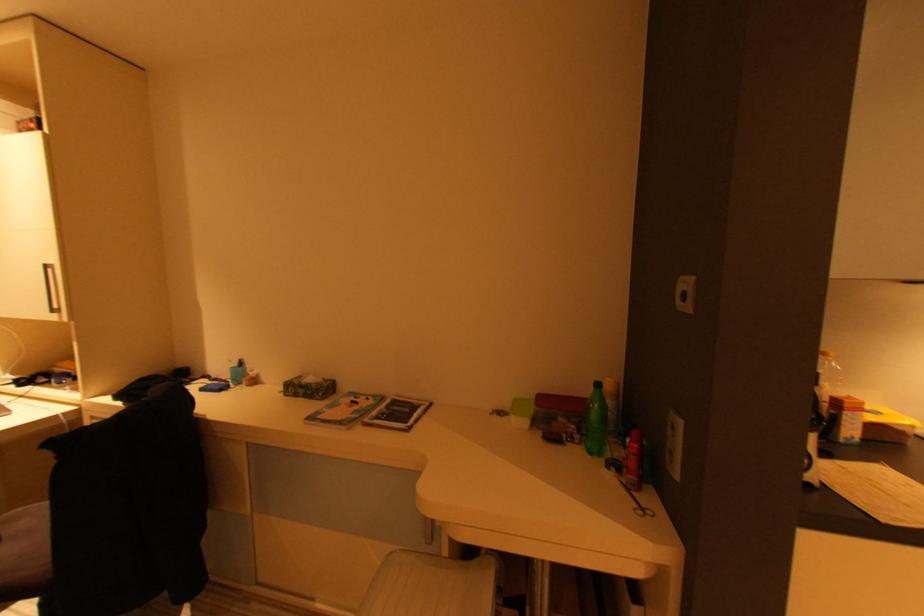
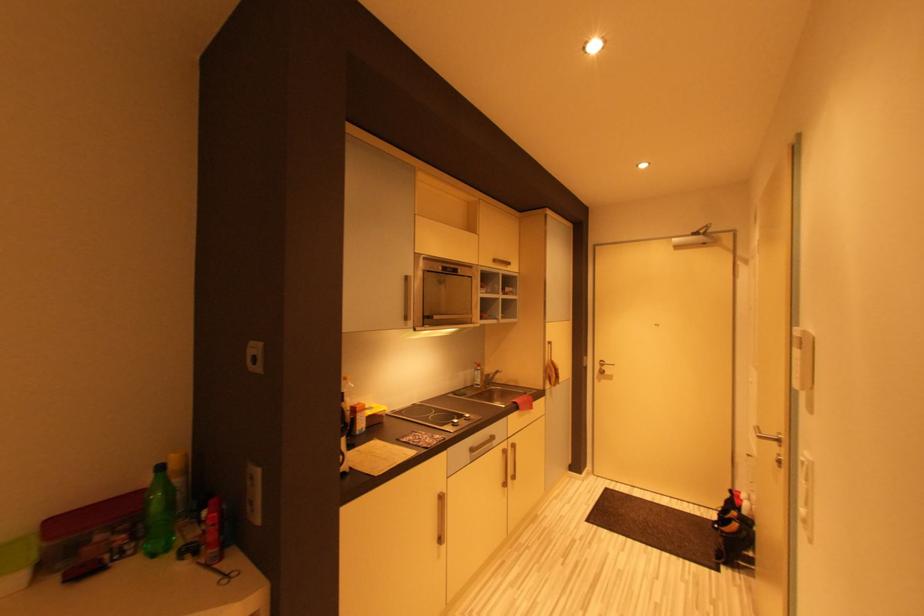
Question: The camera is either moving clockwise (left) or counter-clockwise (right) around the object. The first image is from the beginning of the video and the second image is from the end. Is the camera moving left or right when shooting the video?

Choices:
 (A) Left
 (B) Right

Answer: (A)